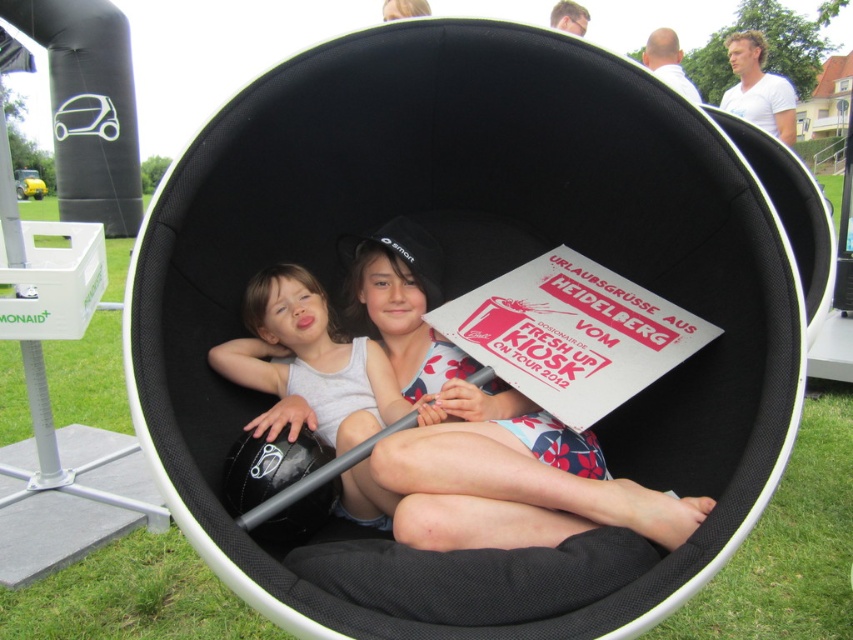
Question: Can you confirm if matte black hat at center is smaller than matte white tank top at center?

Choices:
 (A) no
 (B) yes

Answer: (A)

Question: Is matte black hat at center positioned behind matte white tank top at center?

Choices:
 (A) no
 (B) yes

Answer: (A)

Question: Does matte black hat at center lie behind matte white tank top at center?

Choices:
 (A) yes
 (B) no

Answer: (B)

Question: Which point is farther to the camera?

Choices:
 (A) (267, 269)
 (B) (395, 289)

Answer: (B)

Question: Which point appears farthest from the camera in this image?

Choices:
 (A) (375, 429)
 (B) (521, 458)

Answer: (A)